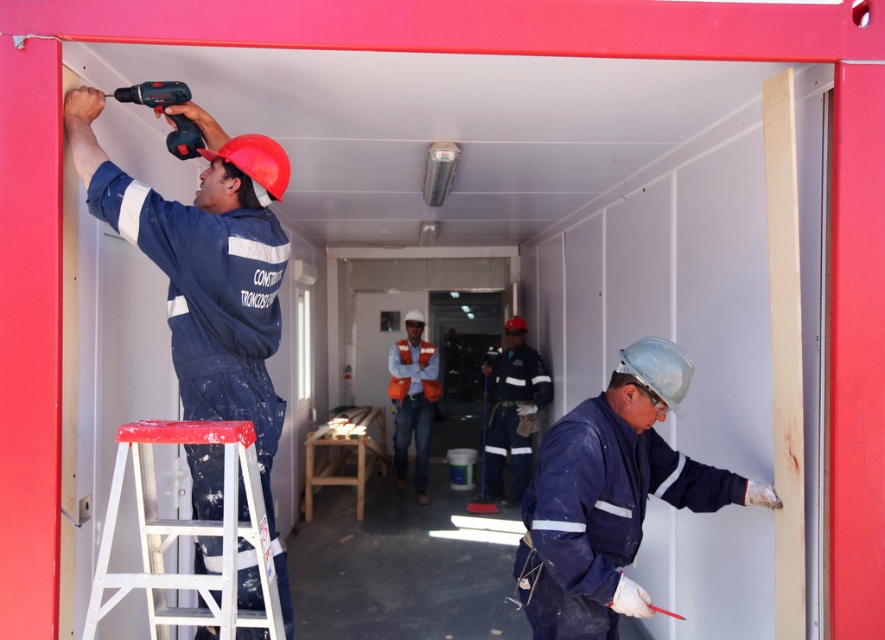
Question: Among these points, which one is nearest to the camera?

Choices:
 (A) (403, 387)
 (B) (248, 182)

Answer: (B)

Question: Can you confirm if blue matte workwear at center is bigger than white plastic ladder at lower left?

Choices:
 (A) no
 (B) yes

Answer: (B)

Question: Where is blue matte workwear at center located in relation to white plastic ladder at lower left in the image?

Choices:
 (A) below
 (B) above

Answer: (A)

Question: Is blue fabric uniform at center to the left of orange reflective vest at center from the viewer's perspective?

Choices:
 (A) no
 (B) yes

Answer: (A)

Question: Which point is farther to the camera?

Choices:
 (A) (255, 474)
 (B) (167, 145)

Answer: (B)

Question: Which point appears closest to the camera in this image?

Choices:
 (A) (177, 221)
 (B) (402, 397)
 (C) (644, 410)
 (D) (206, 612)

Answer: (D)